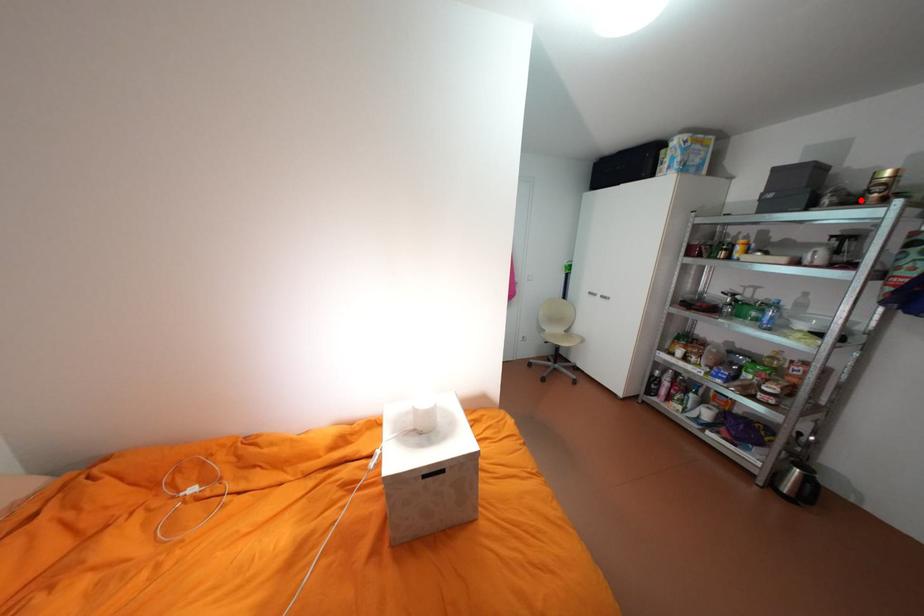
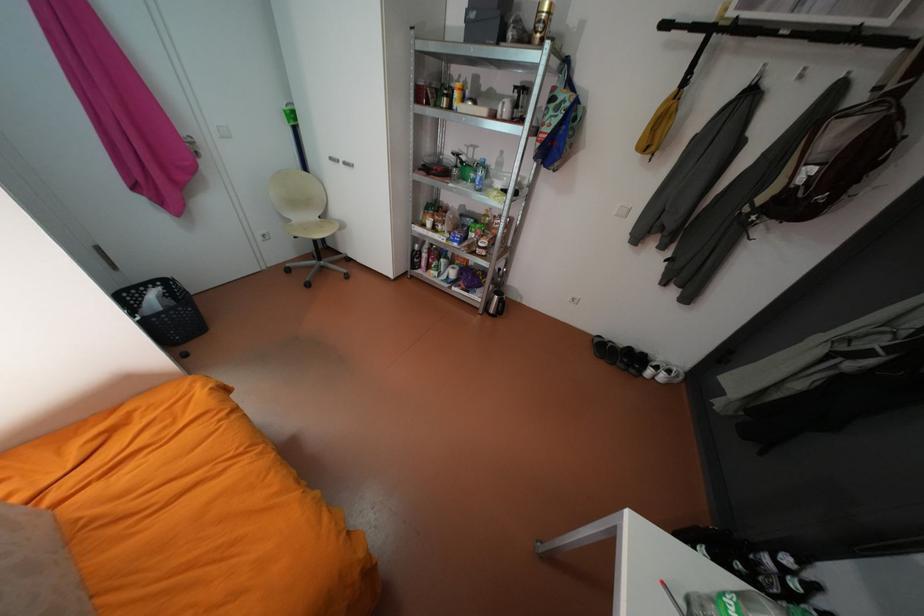
The point at the highlighted location is marked in the first image. Where is the corresponding point in the second image?

(533, 39)